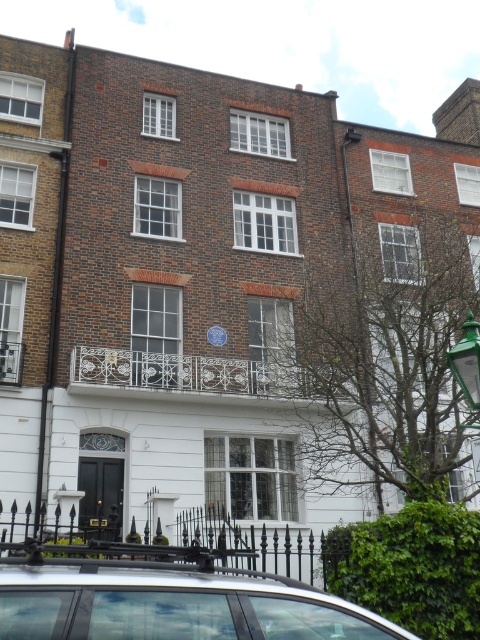
Based on the photo, you are a delivery driver approaching the entrance of the building. You need to park your silver metallic car at lower left next to the green glass lamp post at right. Given that the space between the fence and the building is narrow, can your car fit there if the lamp post is already occupying part of the space?

The silver metallic car at lower left is narrower than the green glass lamp post at right, so it can fit in the space next to the lamp post as long as there is enough room for both.

You are a delivery person approaching the entrance of the building. You see a silver metallic car at lower left and a green glass lamp post at right. Which object is closer to the entrance?

The silver metallic car at lower left is closer to the entrance because it is in front of the green glass lamp post at right, meaning it is positioned between the entrance and the lamp post.